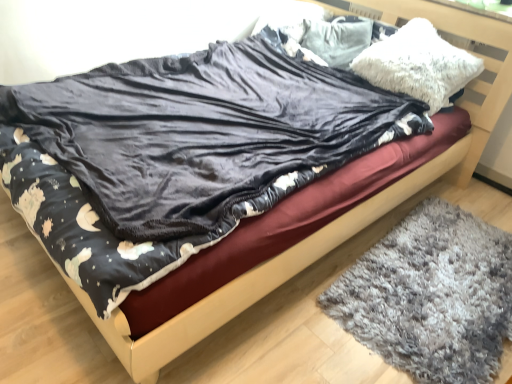
Question: Is white fluffy pillow at upper center, the 2th pillow positioned from the front, not near velvet dark blue blanket at center?

Choices:
 (A) no
 (B) yes

Answer: (A)

Question: Is white fluffy pillow at upper center, the 2th pillow positioned from the front, positioned beyond the bounds of velvet dark blue blanket at center?

Choices:
 (A) no
 (B) yes

Answer: (B)

Question: Could you tell me if white fluffy pillow at upper center, the 2th pillow positioned from the front, is turned towards velvet dark blue blanket at center?

Choices:
 (A) no
 (B) yes

Answer: (B)

Question: Is velvet dark blue blanket at center at the back of white fluffy pillow at upper center, the 1th pillow in the back-to-front sequence?

Choices:
 (A) no
 (B) yes

Answer: (A)

Question: Can you confirm if white fluffy pillow at upper center, the 2th pillow positioned from the front, is bigger than velvet dark blue blanket at center?

Choices:
 (A) yes
 (B) no

Answer: (B)

Question: Is wooden bed frame at center spatially inside white fluffy pillow at upper right, the 2th pillow positioned from the back, or outside of it?

Choices:
 (A) inside
 (B) outside

Answer: (B)

Question: From a real-world perspective, is wooden bed frame at center positioned above or below white fluffy pillow at upper right, the 2th pillow positioned from the back?

Choices:
 (A) below
 (B) above

Answer: (A)

Question: In the image, is wooden bed frame at center on the left side or the right side of white fluffy pillow at upper right, the 2th pillow positioned from the back?

Choices:
 (A) right
 (B) left

Answer: (B)

Question: In terms of size, does wooden bed frame at center appear bigger or smaller than white fluffy pillow at upper right, the 2th pillow positioned from the back?

Choices:
 (A) big
 (B) small

Answer: (A)

Question: Considering the relative positions of wooden bed frame at center and gray shaggy rug at lower right in the image provided, is wooden bed frame at center to the left or to the right of gray shaggy rug at lower right?

Choices:
 (A) right
 (B) left

Answer: (B)

Question: Is wooden bed frame at center inside the boundaries of gray shaggy rug at lower right, or outside?

Choices:
 (A) inside
 (B) outside

Answer: (B)

Question: From a real-world perspective, is wooden bed frame at center positioned above or below gray shaggy rug at lower right?

Choices:
 (A) below
 (B) above

Answer: (A)

Question: In terms of width, does wooden bed frame at center look wider or thinner when compared to gray shaggy rug at lower right?

Choices:
 (A) thin
 (B) wide

Answer: (B)

Question: Visually, is white fluffy pillow at upper right, the first pillow in the front-to-back sequence, positioned to the left or to the right of white fluffy pillow at upper center, the 1th pillow in the back-to-front sequence?

Choices:
 (A) left
 (B) right

Answer: (B)

Question: Considering their positions, is white fluffy pillow at upper right, the 2th pillow positioned from the back, located in front of or behind white fluffy pillow at upper center, the 2th pillow positioned from the front?

Choices:
 (A) behind
 (B) front

Answer: (B)